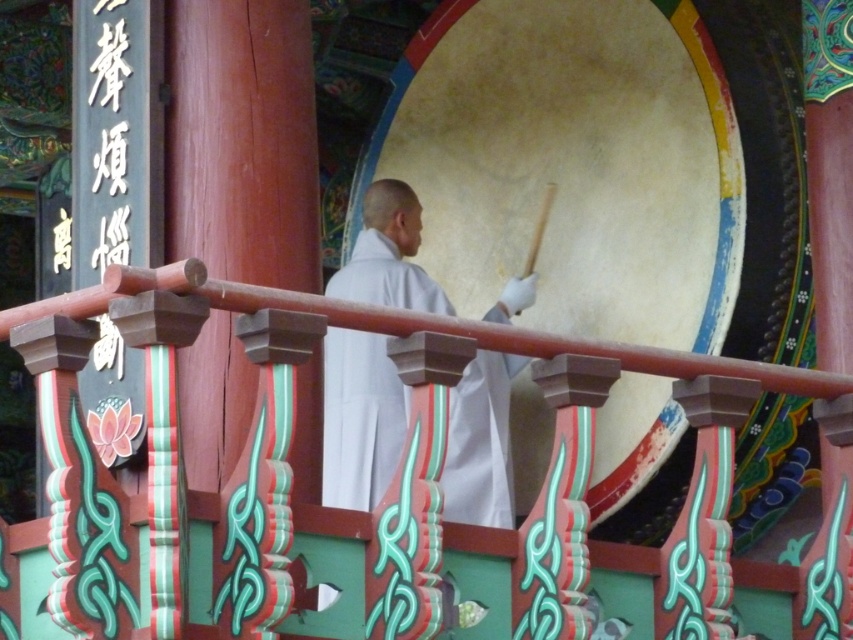
Which of these two, smooth beige drum at center or white cloth monk at center, stands taller?

smooth beige drum at center

Who is higher up, smooth beige drum at center or white cloth monk at center?

smooth beige drum at center

Where is `smooth beige drum at center`? This screenshot has height=640, width=853. smooth beige drum at center is located at coordinates (572, 163).

I want to click on smooth beige drum at center, so 572,163.